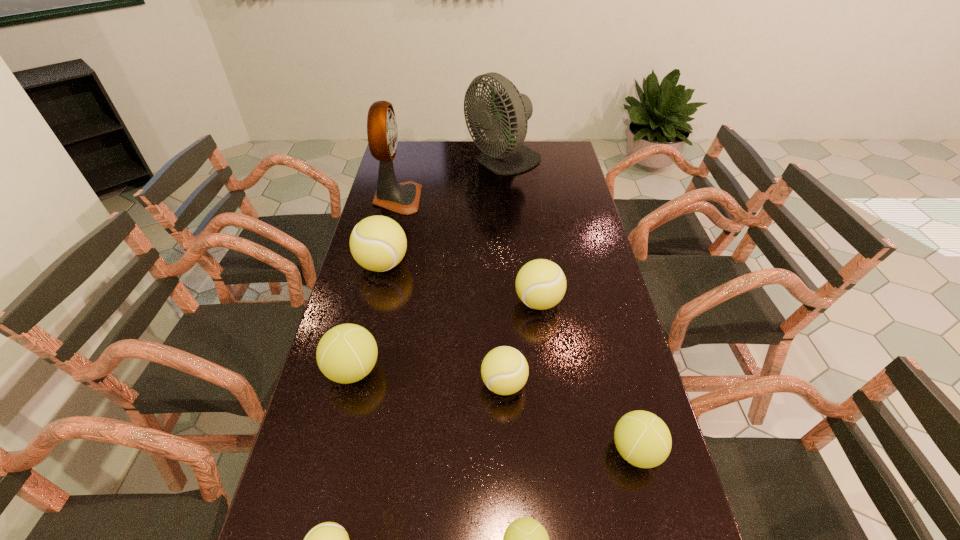
Where is `empty location between the gray fan and the leftmost green tennis ball`? empty location between the gray fan and the leftmost green tennis ball is located at coordinates (428, 267).

The height and width of the screenshot is (540, 960). I want to click on free space between the biggest green tennis ball and the right fan, so click(x=428, y=267).

Identify the location of free area in between the brown fan and the second farthest yellow tennis ball. (468, 250).

Locate an element on the screen. This screenshot has height=540, width=960. free space between the left fan and the second smallest yellow tennis ball is located at coordinates (450, 292).

Identify the location of object that can be found as the fourth closest to the rightmost object. This screenshot has width=960, height=540. (328, 539).

Locate which object is the sixth closest to the gray fan. Please provide its 2D coordinates. Your answer should be formatted as a tuple, i.e. [(x, y)], where the tuple contains the x and y coordinates of a point satisfying the conditions above.

[(643, 439)]

Identify which tennis ball is the sixth nearest to the second farthest tennis ball. Please provide its 2D coordinates. Your answer should be formatted as a tuple, i.e. [(x, y)], where the tuple contains the x and y coordinates of a point satisfying the conditions above.

[(328, 539)]

I want to click on the second closest tennis ball to the left fan, so click(540, 284).

Identify which yellow tennis ball is the second nearest to the second green tennis ball from right to left. Please provide its 2D coordinates. Your answer should be formatted as a tuple, i.e. [(x, y)], where the tuple contains the x and y coordinates of a point satisfying the conditions above.

[(328, 539)]

Image resolution: width=960 pixels, height=540 pixels. What are the coordinates of `yellow tennis ball that stands as the second closest to the sixth nearest object` in the screenshot? It's located at (378, 243).